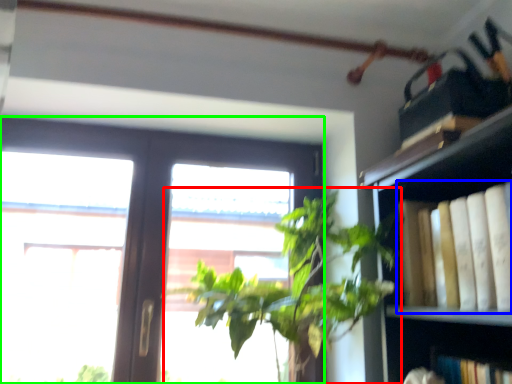
Question: Estimate the real-world distances between objects in this image. Which object is closer to houseplant (highlighted by a red box), book (highlighted by a blue box) or window (highlighted by a green box)?

Choices:
 (A) book
 (B) window

Answer: (A)